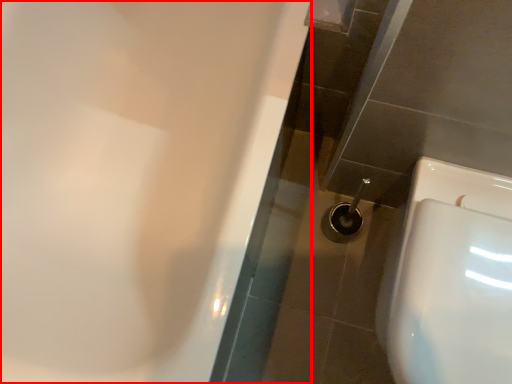
Question: From the image's perspective, where is bath (annotated by the red box) located relative to toilet?

Choices:
 (A) below
 (B) above

Answer: (B)